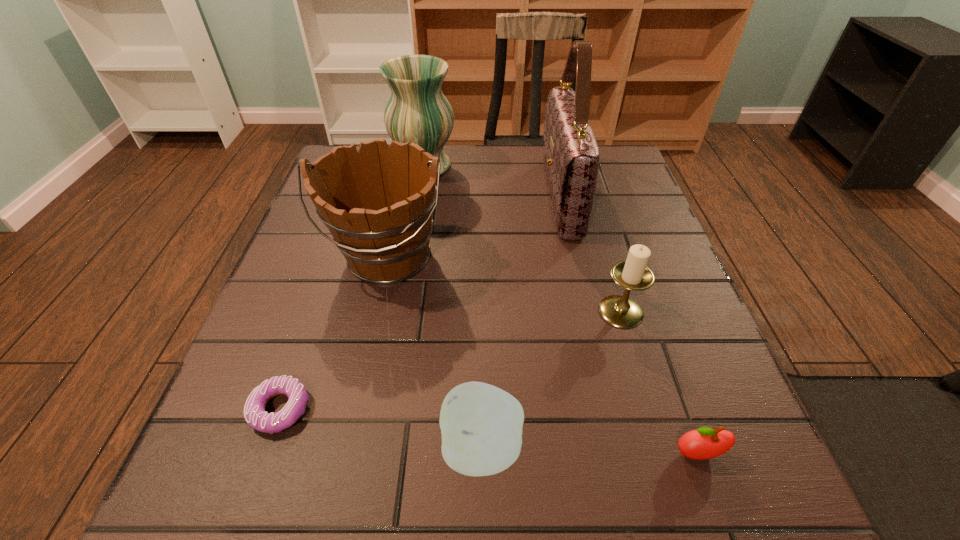
Find the location of a particular element. The image size is (960, 540). free space located on the front of the handbag with the clasp is located at coordinates (378, 197).

Locate an element on the screen. The height and width of the screenshot is (540, 960). free space located 0.140m on the front of the handbag with the clasp is located at coordinates (486, 197).

Find the location of a particular element. Image resolution: width=960 pixels, height=540 pixels. vacant space situated on the front of the vase is located at coordinates 411,244.

Where is `free space located 0.160m with the handle on the wine bucket`? The width and height of the screenshot is (960, 540). free space located 0.160m with the handle on the wine bucket is located at coordinates (362, 370).

You are a GUI agent. You are given a task and a screenshot of the screen. Output one action in this format:
    pyautogui.click(x=<x>, y=<y>)
    Task: Click on the vacant space situated 0.320m on the back of the fourth tallest object
    Image resolution: width=960 pixels, height=540 pixels.
    Given the screenshot: What is the action you would take?
    point(588,198)

I want to click on vacant space located 0.260m on the right of the taller apple, so click(703, 448).

Identify the location of blank space located 0.250m on the back of the right apple. (647, 312).

Find the location of `free space located 0.160m on the back of the shortest object`. free space located 0.160m on the back of the shortest object is located at coordinates (316, 308).

You are a GUI agent. You are given a task and a screenshot of the screen. Output one action in this format:
    pyautogui.click(x=<x>, y=<y>)
    Task: Click on the handbag positioned at the far edge
    Image resolution: width=960 pixels, height=540 pixels.
    Given the screenshot: What is the action you would take?
    pos(571,156)

This screenshot has width=960, height=540. What are the coordinates of `vase present at the far edge` in the screenshot? It's located at [417, 112].